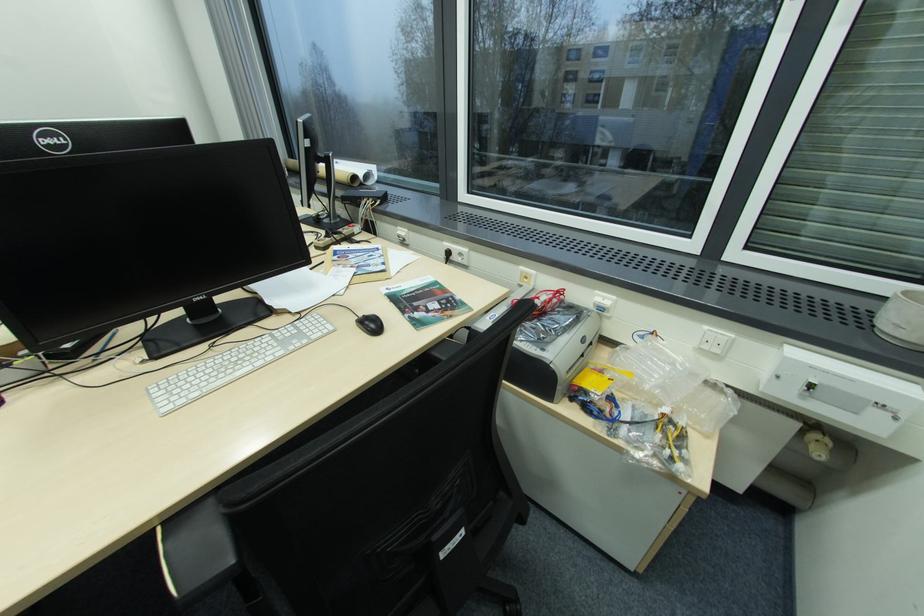
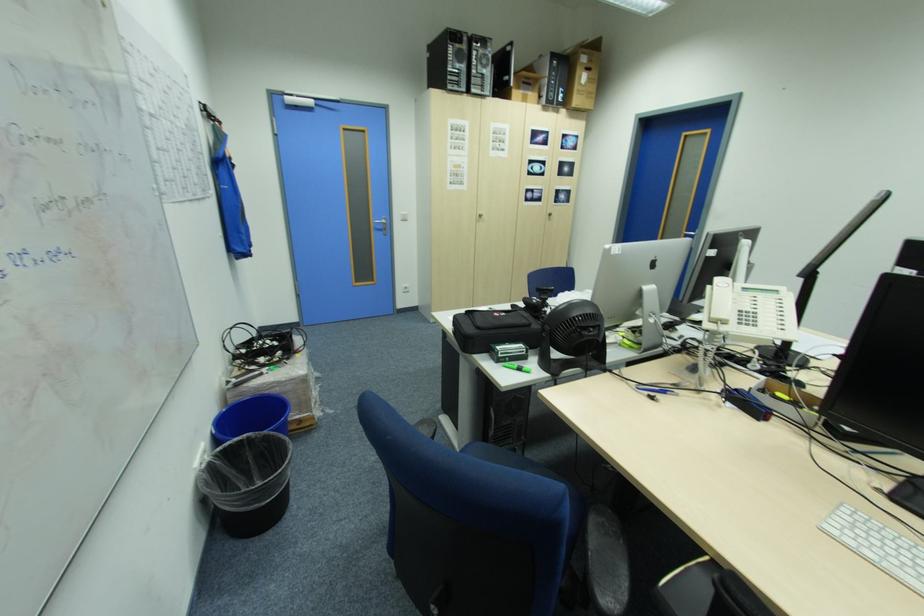
First-person continuous shooting, in which direction is the camera rotating?

The camera rotated toward left-down.